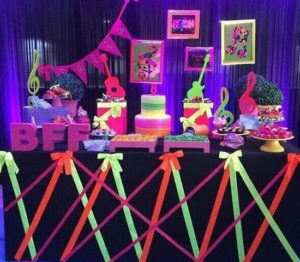
The height and width of the screenshot is (262, 300). Find the location of `picture`. picture is located at coordinates (191, 64).